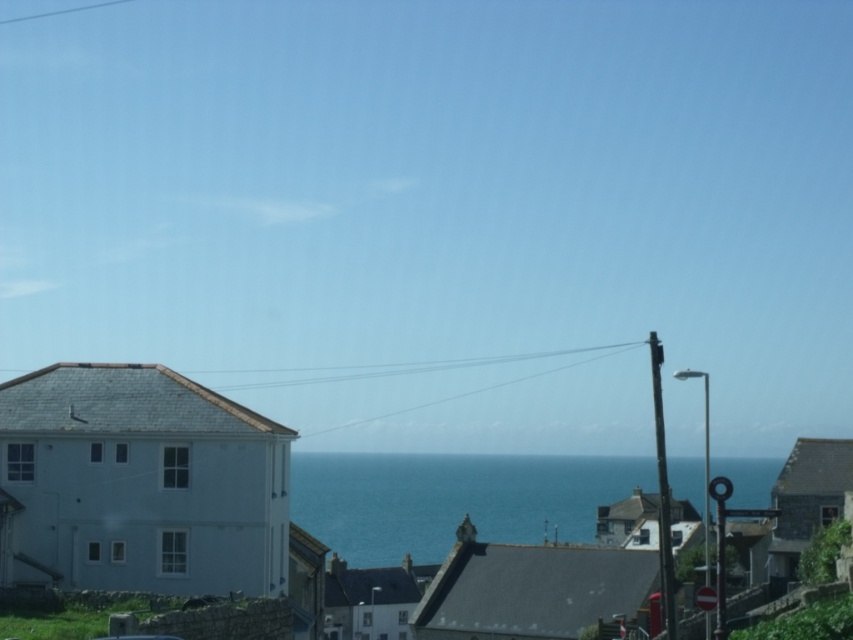
You are standing at the coast and see the white matte building at lower left and the blue water at center. Which object is closer to your left side?

The white matte building at lower left is positioned on the left side of blue water at center, so it is closer to your left side.

Consider the image. You are a photographer planning to capture the coastal scene. You have a camera with a lens that can only focus on objects wider than 2 meters. Based on the scene, will the white matte building at lower left and the blue water at center both be in focus?

The white matte building at lower left is thinner than blue water at center. Since the lens requires objects wider than 2 meters, if the blue water at center is wider than 2 meters, the building might be thinner than 2 meters and thus not in focus. However, without exact measurements, it is uncertain. The answer cannot be definitively determined from the provided information.